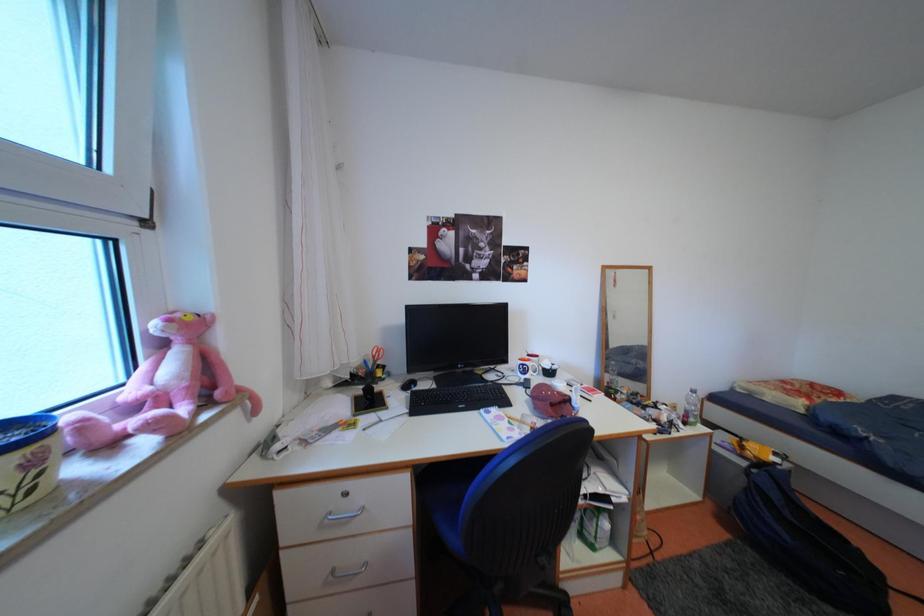
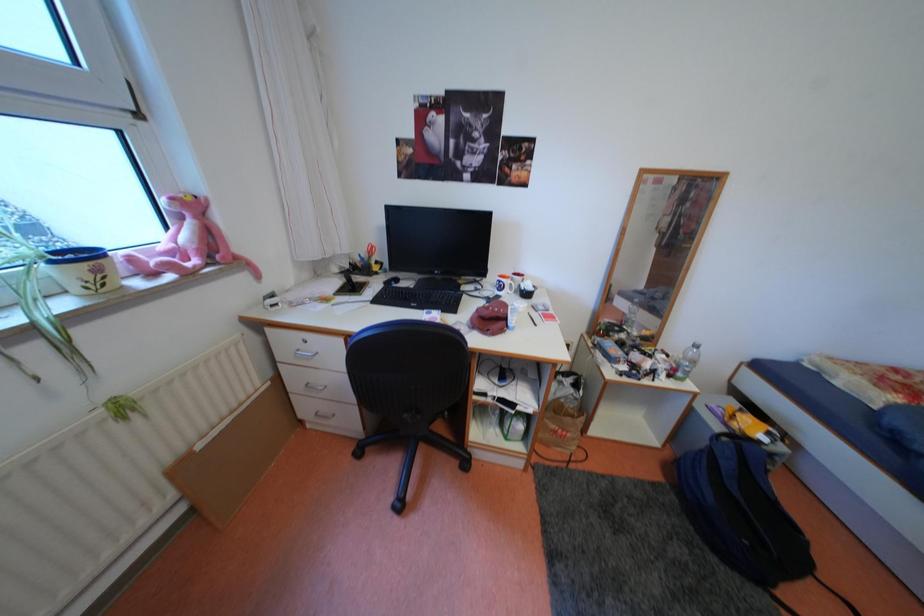
Question: Which direction would the cameraman need to move to produce the second image? Reply with the corresponding letter.

Choices:
 (A) Left
 (B) Right
 (C) Forward
 (D) Backward

Answer: (B)